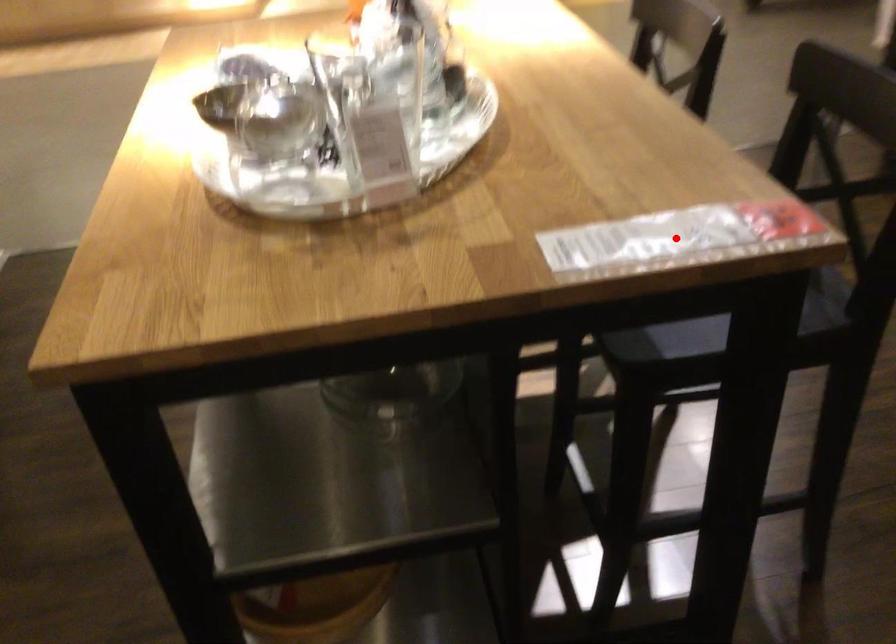
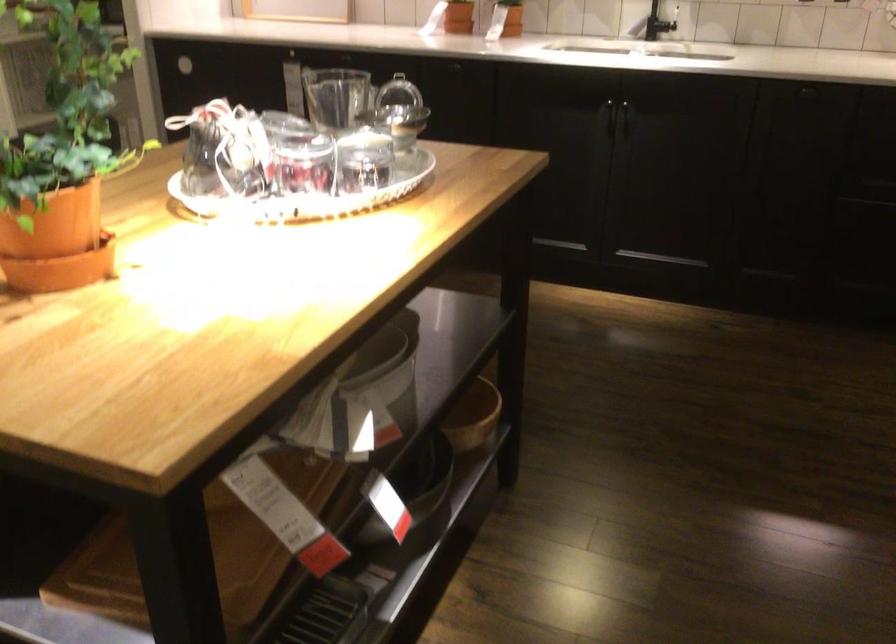
Question: I am providing you with two images of the same scene from different viewpoints. A red point is marked on the first image. Is the red point's position out of view in image 2?

Choices:
 (A) Yes
 (B) No

Answer: (A)